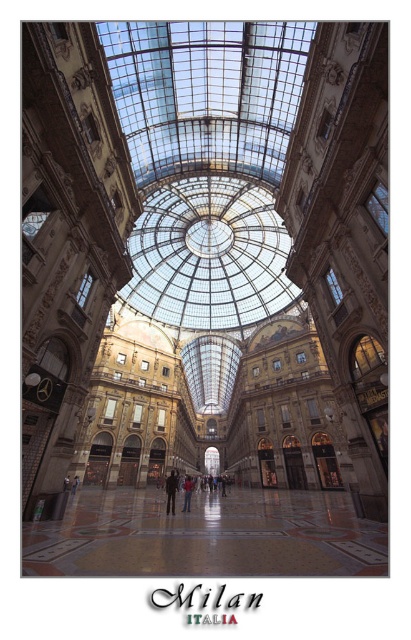
Question: Is transparent glass dome at center smaller than red fabric jacket at center?

Choices:
 (A) no
 (B) yes

Answer: (A)

Question: Which object is positioned closest to the polished marble floor at center?

Choices:
 (A) transparent glass dome at center
 (B) dark brown leather jacket at center

Answer: (B)

Question: Which point is farther from the camera taking this photo?

Choices:
 (A) (256, 284)
 (B) (168, 493)

Answer: (A)

Question: Is transparent glass dome at center bigger than red fabric jacket at center?

Choices:
 (A) no
 (B) yes

Answer: (B)

Question: Estimate the real-world distances between objects in this image. Which object is closer to the red fabric jacket at center?

Choices:
 (A) polished marble floor at center
 (B) dark brown leather jacket at center

Answer: (B)

Question: Can you confirm if transparent glass dome at center is positioned below dark brown leather jacket at center?

Choices:
 (A) yes
 (B) no

Answer: (B)